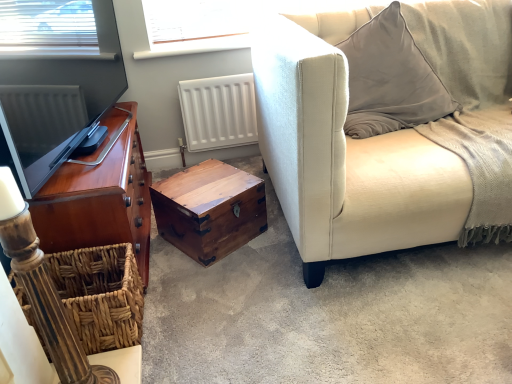
You are a GUI agent. You are given a task and a screenshot of the screen. Output one action in this format:
    pyautogui.click(x=<x>, y=<y>)
    Task: Click on the empty space that is to the right of wooden chest at center
    The image size is (512, 384).
    Given the screenshot: What is the action you would take?
    pyautogui.click(x=273, y=236)